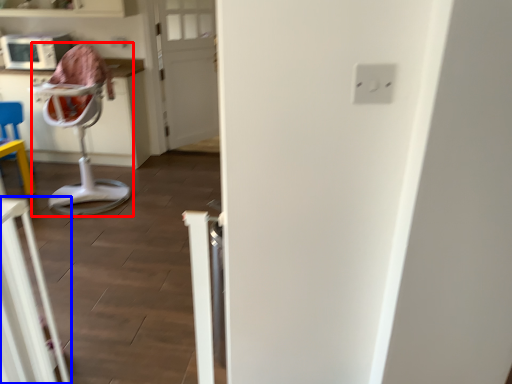
Question: Which object appears closest to the camera in this image, feeding chair (highlighted by a red box) or furniture (highlighted by a blue box)?

Choices:
 (A) feeding chair
 (B) furniture

Answer: (B)